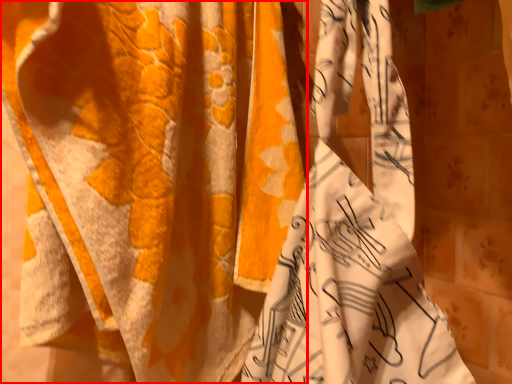
Question: From the image's perspective, where is curtain (annotated by the red box) located in relation to curtain in the image?

Choices:
 (A) above
 (B) below

Answer: (A)